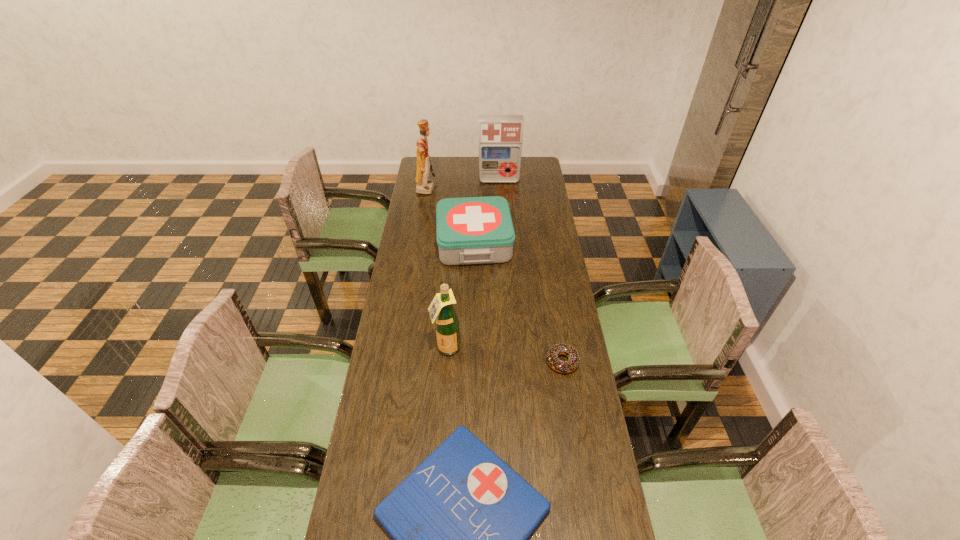
The height and width of the screenshot is (540, 960). What are the coordinates of `nutcracker` in the screenshot? It's located at (424, 186).

The width and height of the screenshot is (960, 540). In order to click on the tallest first-aid kit in this screenshot , I will do `click(500, 136)`.

Identify the location of liquor. This screenshot has height=540, width=960. (447, 323).

This screenshot has height=540, width=960. What are the coordinates of `the third shortest object` in the screenshot? It's located at (474, 230).

Find the location of a particular element. This screenshot has width=960, height=540. the second nearest first-aid kit is located at coordinates (474, 230).

Where is `the rightmost object`? The height and width of the screenshot is (540, 960). the rightmost object is located at coordinates coord(560,366).

Locate an element on the screen. vacant area located 0.090m on the front-facing side of the nutcracker is located at coordinates (453, 188).

The height and width of the screenshot is (540, 960). Identify the location of vacant region located 0.190m on the front-facing side of the farthest first-aid kit. coord(500,204).

The height and width of the screenshot is (540, 960). I want to click on free spot located on the front-facing side of the liquor, so click(444, 370).

Find the location of a particular element. free space located on the front of the third shortest object is located at coordinates (473, 300).